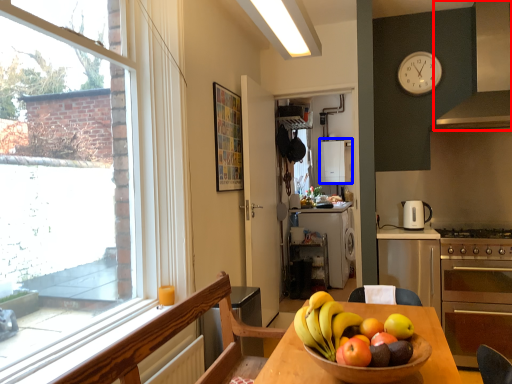
Question: Which object is closer to the camera taking this photo, exhaust hood (highlighted by a red box) or appliance (highlighted by a blue box)?

Choices:
 (A) exhaust hood
 (B) appliance

Answer: (A)